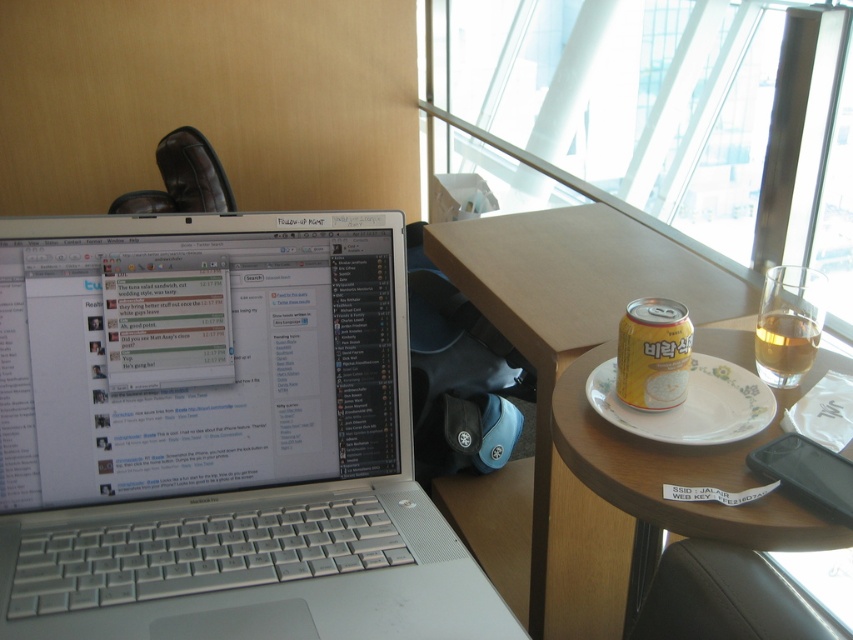
Question: Among these objects, which one is farthest from the camera?

Choices:
 (A) wooden table at center
 (B) yellow matte can at right

Answer: (A)

Question: Which object is positioned farthest from the yellow matte can at right?

Choices:
 (A) wooden table at center
 (B) silver metallic laptop at center
 (C) white floral plate at center
 (D) translucent glass at upper right

Answer: (A)

Question: Is transparent glass window at upper center smaller than translucent glass at upper right?

Choices:
 (A) no
 (B) yes

Answer: (A)

Question: Can you confirm if silver metallic laptop at center is thinner than transparent glass window at upper center?

Choices:
 (A) no
 (B) yes

Answer: (B)

Question: Does wooden table at center have a smaller size compared to translucent glass at upper right?

Choices:
 (A) no
 (B) yes

Answer: (A)

Question: Which is farther from the silver metallic laptop at center?

Choices:
 (A) transparent glass window at upper center
 (B) translucent glass at upper right
 (C) wooden table at center

Answer: (A)